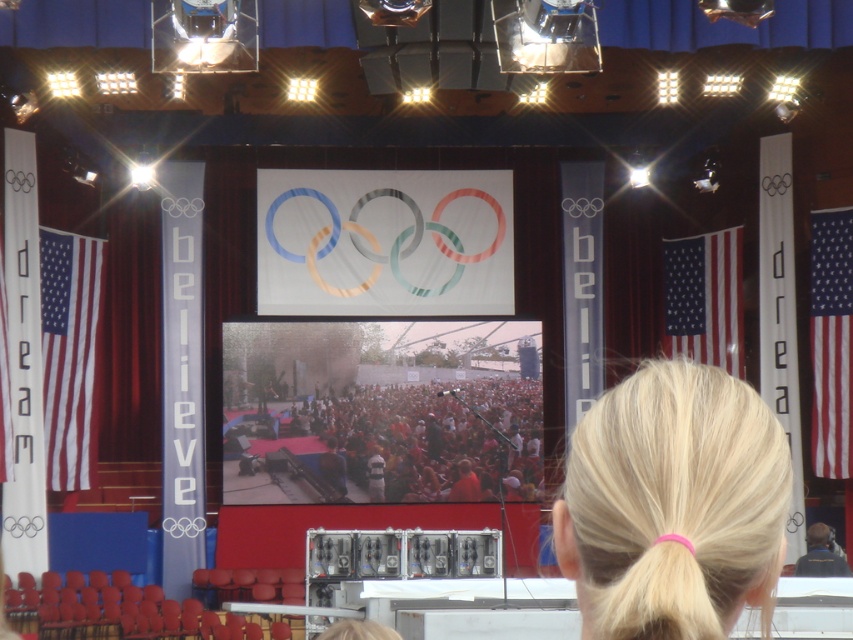
You are an event organizer checking the stage setup. You need to ensure that the pink rubber band at upper center and the american flag at left are visible to the audience. Given their widths, which object might require adjustment to ensure visibility?

The pink rubber band at upper center has a smaller width than the american flag at left, so it might require adjustment to ensure visibility.

You are an event organizer checking the stage setup for alignment. You notice the pink rubber band at upper center and the matte fabric flag at right. Which object is located to the left of the other?

The pink rubber band at upper center is positioned on the left side of matte fabric flag at right.